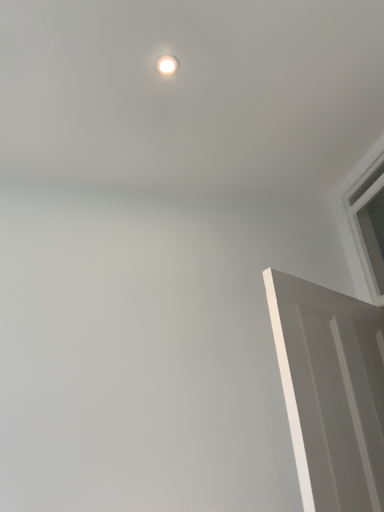
Question: Is white matte door at right taller or shorter than white glossy light fixture at upper center?

Choices:
 (A) short
 (B) tall

Answer: (B)

Question: Would you say white matte door at right is to the left or to the right of white glossy light fixture at upper center in the picture?

Choices:
 (A) left
 (B) right

Answer: (B)

Question: Which object is the farthest from the white matte door at right?

Choices:
 (A) white plastic window at upper right
 (B) white glossy light fixture at upper center

Answer: (B)

Question: Which object is positioned closest to the white plastic window at upper right?

Choices:
 (A) white glossy light fixture at upper center
 (B) white matte door at right

Answer: (B)